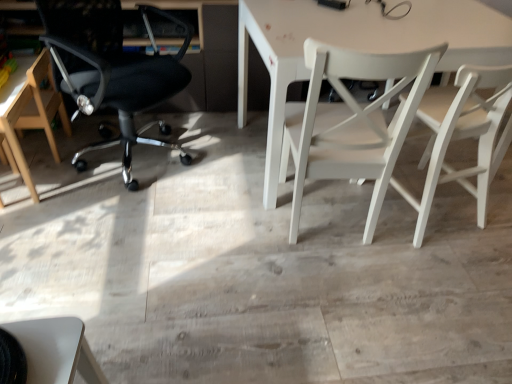
Question: Considering the positions of point (325, 125) and point (357, 49), is point (325, 125) closer or farther from the camera than point (357, 49)?

Choices:
 (A) closer
 (B) farther

Answer: (B)

Question: From their relative heights in the image, would you say white matte chair at center, the third chair from the left, is taller or shorter than white matte table at center?

Choices:
 (A) short
 (B) tall

Answer: (B)

Question: Which of these objects is positioned closest to the white wood chair at right, placed as the fourth chair when sorted from left to right?

Choices:
 (A) white matte chair at center, the 2th chair from the right
 (B) light brown wooden chair at left, marked as the fourth chair in a right-to-left arrangement
 (C) white matte table at center
 (D) wooden floor at center
 (E) black mesh office chair at left, which is counted as the 3th chair, starting from the right

Answer: (A)

Question: Estimate the real-world distances between objects in this image. Which object is farther from the black mesh office chair at left, which is counted as the 3th chair, starting from the right?

Choices:
 (A) white wood chair at right, which is the 1th chair in right-to-left order
 (B) wooden floor at center
 (C) light brown wooden chair at left, which is the 1th chair from left to right
 (D) white matte chair at center, the 2th chair from the right
 (E) white matte table at center

Answer: (A)